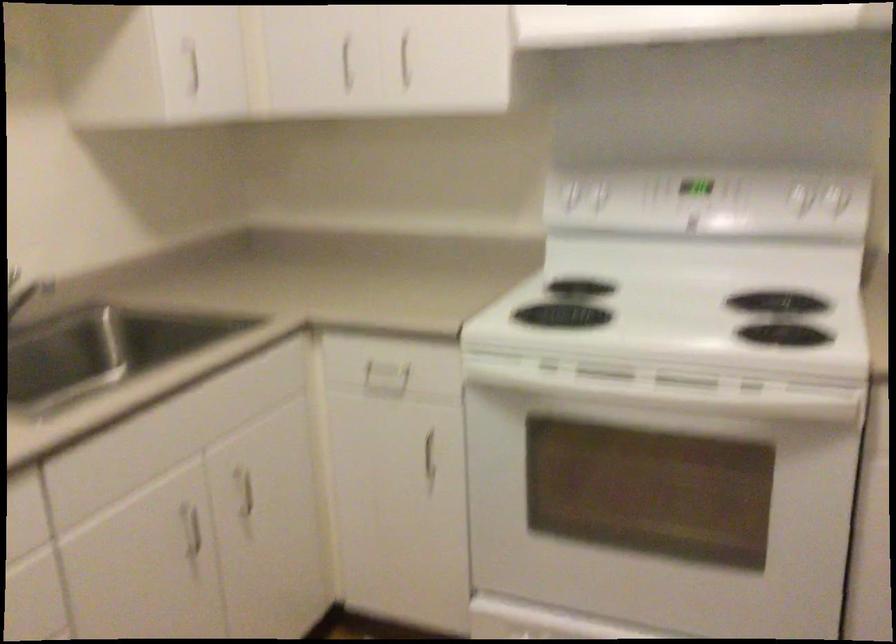
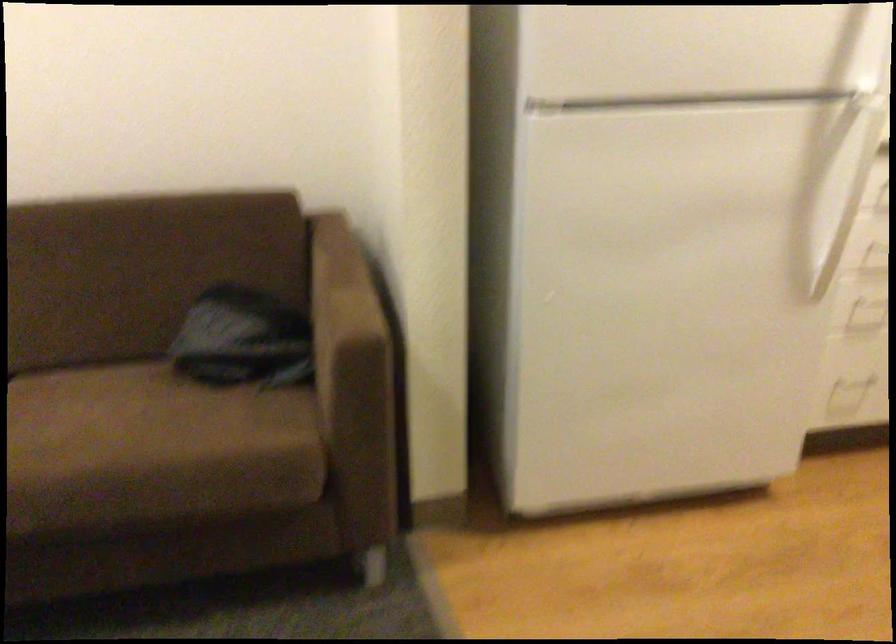
The first image is from the beginning of the video and the second image is from the end. How did the camera likely rotate when shooting the video?

The camera's rotation is toward left-down.